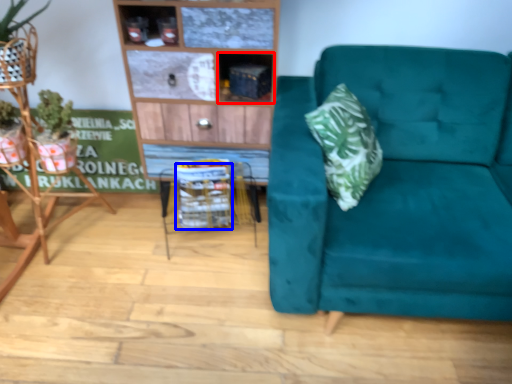
Question: Among these objects, which one is nearest to the camera, cabinet (highlighted by a red box) or basket (highlighted by a blue box)?

Choices:
 (A) cabinet
 (B) basket

Answer: (A)